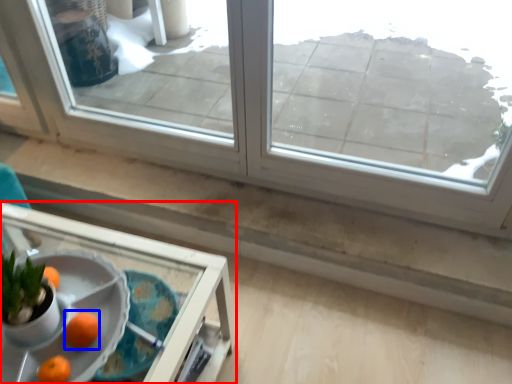
Question: Which point is closer to the camera, table (highlighted by a red box) or orange (highlighted by a blue box)?

Choices:
 (A) table
 (B) orange

Answer: (A)